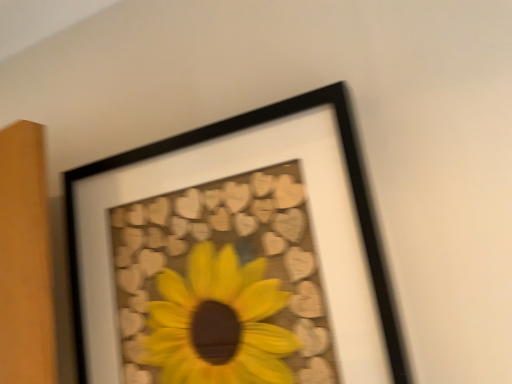
What do you see at coordinates (234, 256) in the screenshot? I see `black matte picture frame at upper center` at bounding box center [234, 256].

At what (x,y) coordinates should I click in order to perform the action: click on black matte picture frame at upper center. Please return your answer as a coordinate pair (x, y). Image resolution: width=512 pixels, height=384 pixels. Looking at the image, I should click on (234, 256).

You are a GUI agent. You are given a task and a screenshot of the screen. Output one action in this format:
    pyautogui.click(x=<x>, y=<y>)
    Task: Click on the black matte picture frame at upper center
    Image resolution: width=512 pixels, height=384 pixels.
    Given the screenshot: What is the action you would take?
    pyautogui.click(x=234, y=256)